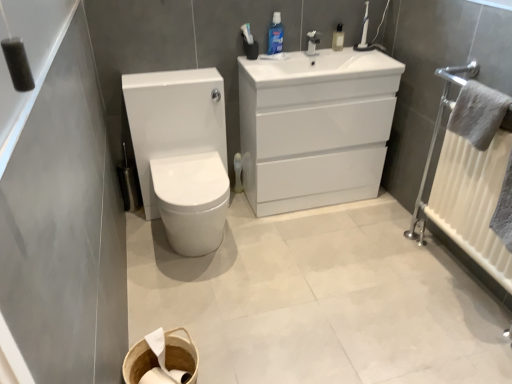
Question: From a real-world perspective, relative to white glossy sink at upper center, is white plastic radiator at right vertically above or below?

Choices:
 (A) above
 (B) below

Answer: (B)

Question: In the image, is white plastic radiator at right positioned in front of or behind white glossy sink at upper center?

Choices:
 (A) behind
 (B) front

Answer: (B)

Question: Estimate the real-world distances between objects in this image. Which object is farther from the white glossy sink at upper center?

Choices:
 (A) blue glossy mouthwash at upper center, which is the first mouthwash in right-to-left order
 (B) blue glossy mouthwash at upper center, the 2th mouthwash positioned from the right
 (C) white glossy toilet at left
 (D) white woven basket at lower center
 (E) white glossy cabinet at upper center

Answer: (D)

Question: Which object is the farthest from the gray fluffy towel at right?

Choices:
 (A) white plastic radiator at right
 (B) white glossy toilet at left
 (C) blue glossy mouthwash at upper center, which is the first mouthwash in right-to-left order
 (D) white woven basket at lower center
 (E) white glossy sink at upper center

Answer: (D)